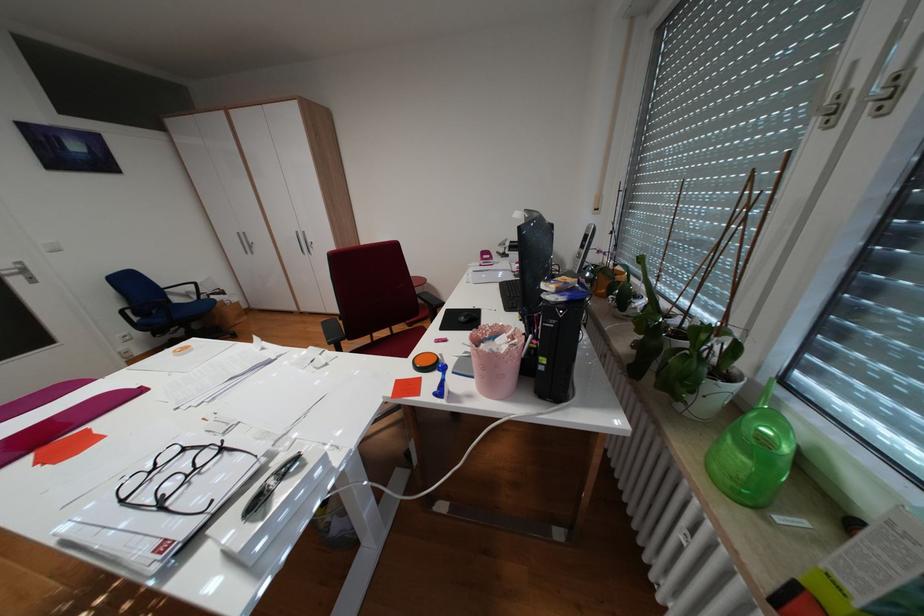
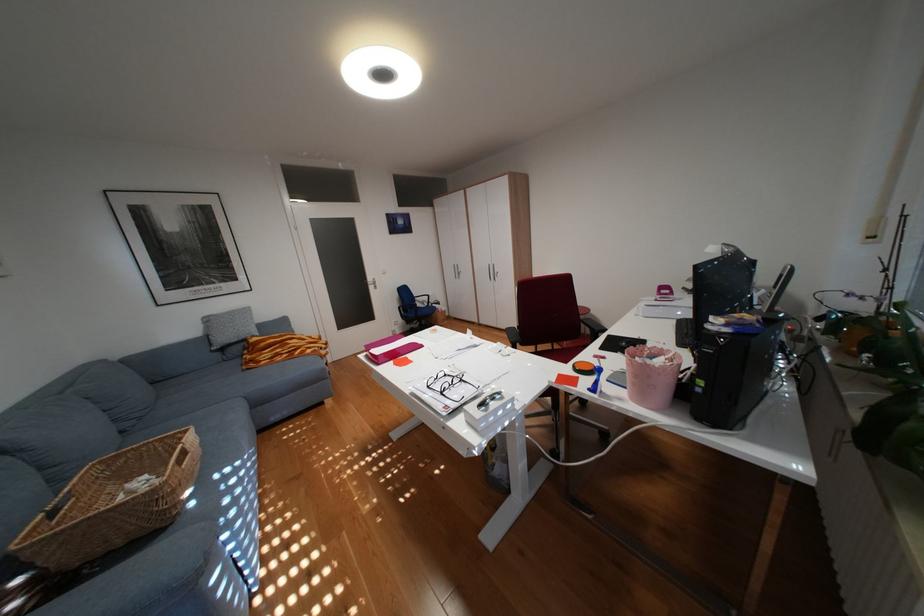
Locate, in the second image, the point that corresponds to pixel 173 505 in the first image.

(454, 392)